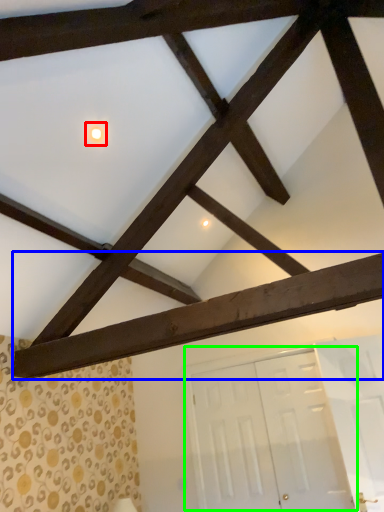
Question: Considering the real-world distances, which object is farthest from light (highlighted by a red box)? plank (highlighted by a blue box) or door (highlighted by a green box)?

Choices:
 (A) plank
 (B) door

Answer: (B)